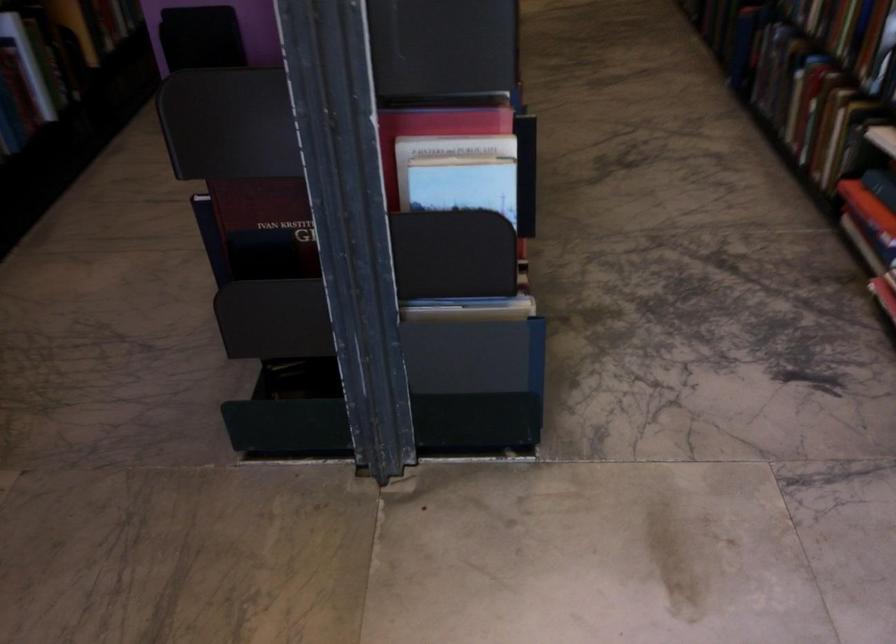
Question: The camera is either moving clockwise (left) or counter-clockwise (right) around the object. The first image is from the beginning of the video and the second image is from the end. Is the camera moving left or right when shooting the video?

Choices:
 (A) Left
 (B) Right

Answer: (A)